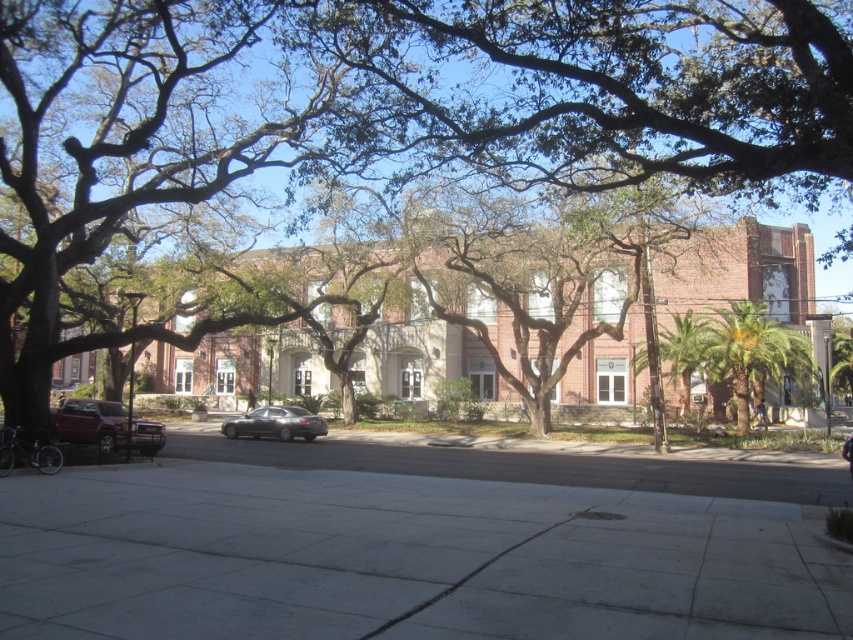
You are a delivery person needing to park your matte red car at lower left near the gray concrete sidewalk at center. Based on the scene, can you park the car so that it is directly to the right of the sidewalk?

The gray concrete sidewalk at center is already positioned on the right side of the matte red car at lower left, so the car is already parked to the left of the sidewalk. Therefore, you cannot park the car directly to the right of the sidewalk as it is already positioned to the left.

You are a delivery person needing to park your matte red car at lower left. The parking spot available is the size of the gray concrete sidewalk at center. Will your car fit?

The gray concrete sidewalk at center is larger in size than the matte red car at lower left, so the car will fit in the parking spot.

You are a delivery person trying to park your motorcycle between the gray concrete sidewalk at center and the satin black sedan at center. Can you fit your motorcycle there?

The gray concrete sidewalk at center is positioned on the right side of satin black sedan at center, so there is space between them where the motorcycle can be parked.